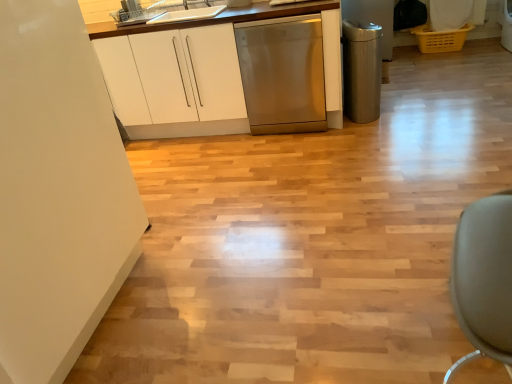
What do you see at coordinates (136, 12) in the screenshot? This screenshot has width=512, height=384. I see `metallic dishwasher at upper center, the 2th appliance positioned from the bottom` at bounding box center [136, 12].

Image resolution: width=512 pixels, height=384 pixels. What do you see at coordinates (283, 74) in the screenshot?
I see `stainless steel dishwasher at center` at bounding box center [283, 74].

The width and height of the screenshot is (512, 384). Find the location of `matte gray swivel chair at lower right`. matte gray swivel chair at lower right is located at coordinates (484, 279).

Considering the sizes of objects polished stainless steel trash can at right, the first appliance viewed from the right, and matte gray swivel chair at lower right in the image provided, who is shorter, polished stainless steel trash can at right, the first appliance viewed from the right, or matte gray swivel chair at lower right?

polished stainless steel trash can at right, the first appliance viewed from the right, is shorter.

Is point (361, 54) closer or farther from the camera than point (467, 223)?

Point (361, 54) is positioned farther from the camera compared to point (467, 223).

Is polished stainless steel trash can at right, the first appliance ordered from the bottom, not near matte gray swivel chair at lower right?

Yes, polished stainless steel trash can at right, the first appliance ordered from the bottom, and matte gray swivel chair at lower right are quite far apart.

Identify the location of swivel chair in front of the polished stainless steel trash can at right, the second appliance positioned from the left. The width and height of the screenshot is (512, 384). (484, 279).

Which of these two, white glossy cabinet at upper left or metallic dishwasher at upper center, arranged as the first appliance when viewed from the left, is bigger?

Bigger between the two is white glossy cabinet at upper left.

Is white glossy cabinet at upper left inside the boundaries of metallic dishwasher at upper center, the 2th appliance positioned from the bottom, or outside?

white glossy cabinet at upper left is outside metallic dishwasher at upper center, the 2th appliance positioned from the bottom.

Where is `appliance located above the white glossy cabinet at upper left (from a real-world perspective)`? Image resolution: width=512 pixels, height=384 pixels. appliance located above the white glossy cabinet at upper left (from a real-world perspective) is located at coordinates (136, 12).

From a real-world perspective, is white glossy cabinet at upper left positioned over metallic dishwasher at upper center, the 2th appliance from the right, based on gravity?

No, from a real-world perspective, white glossy cabinet at upper left is not over metallic dishwasher at upper center, the 2th appliance from the right

Where is `cabinetry below the polished stainless steel trash can at right, the first appliance viewed from the right (from the image's perspective)`? This screenshot has width=512, height=384. cabinetry below the polished stainless steel trash can at right, the first appliance viewed from the right (from the image's perspective) is located at coordinates (201, 72).

Can you tell me how much white glossy cabinet at upper left and polished stainless steel trash can at right, which appears as the 2th appliance when viewed from the top, differ in facing direction?

The facing directions of white glossy cabinet at upper left and polished stainless steel trash can at right, which appears as the 2th appliance when viewed from the top, are 96.4 degrees apart.

Is white glossy cabinet at upper left positioned with its back to polished stainless steel trash can at right, the first appliance ordered from the bottom?

white glossy cabinet at upper left does not have its back to polished stainless steel trash can at right, the first appliance ordered from the bottom.

Considering the sizes of white glossy cabinet at upper left and polished stainless steel trash can at right, which appears as the 2th appliance when viewed from the top, in the image, is white glossy cabinet at upper left wider or thinner than polished stainless steel trash can at right, which appears as the 2th appliance when viewed from the top,?

white glossy cabinet at upper left is wider than polished stainless steel trash can at right, which appears as the 2th appliance when viewed from the top.

Between metallic dishwasher at upper center, marked as the 1th appliance in a top-to-bottom arrangement, and polished stainless steel trash can at right, the first appliance viewed from the right, which one has less height?

With less height is metallic dishwasher at upper center, marked as the 1th appliance in a top-to-bottom arrangement.

In the scene shown: Is metallic dishwasher at upper center, marked as the 1th appliance in a top-to-bottom arrangement, spatially inside polished stainless steel trash can at right, the first appliance ordered from the bottom, or outside of it?

metallic dishwasher at upper center, marked as the 1th appliance in a top-to-bottom arrangement, is outside polished stainless steel trash can at right, the first appliance ordered from the bottom.

Which of these two, metallic dishwasher at upper center, the 2th appliance from the right, or polished stainless steel trash can at right, the first appliance viewed from the right, is thinner?

With smaller width is polished stainless steel trash can at right, the first appliance viewed from the right.

Is metallic dishwasher at upper center, arranged as the first appliance when viewed from the left, to the left or to the right of polished stainless steel trash can at right, the second appliance positioned from the left, in the image?

From the image, it's evident that metallic dishwasher at upper center, arranged as the first appliance when viewed from the left, is to the left of polished stainless steel trash can at right, the second appliance positioned from the left.

Based on the photo, from a real-world perspective, is polished stainless steel trash can at right, the second appliance positioned from the left, on stainless steel dishwasher at center?

No, from a real-world perspective, polished stainless steel trash can at right, the second appliance positioned from the left, is not on top of stainless steel dishwasher at center.

Measure the distance from polished stainless steel trash can at right, the first appliance viewed from the right, to stainless steel dishwasher at center.

polished stainless steel trash can at right, the first appliance viewed from the right, and stainless steel dishwasher at center are 20.45 inches apart from each other.

Considering the points (378, 89) and (324, 126), which point is in front, point (378, 89) or point (324, 126)?

Positioned in front is point (324, 126).

Is stainless steel dishwasher at center at the back of polished stainless steel trash can at right, the first appliance ordered from the bottom?

Yes, polished stainless steel trash can at right, the first appliance ordered from the bottom, is positioned with its back facing stainless steel dishwasher at center.

From their relative heights in the image, would you say metallic dishwasher at upper center, the 2th appliance positioned from the bottom, is taller or shorter than white glossy cabinet at upper left?

In the image, metallic dishwasher at upper center, the 2th appliance positioned from the bottom, appears to be shorter than white glossy cabinet at upper left.

Could you measure the distance between metallic dishwasher at upper center, the 2th appliance positioned from the bottom, and white glossy cabinet at upper left?

A distance of 21.18 inches exists between metallic dishwasher at upper center, the 2th appliance positioned from the bottom, and white glossy cabinet at upper left.

From the image's perspective, would you say metallic dishwasher at upper center, arranged as the first appliance when viewed from the left, is shown under white glossy cabinet at upper left?

No.

From a real-world perspective, is metallic dishwasher at upper center, the 2th appliance from the right, positioned above or below white glossy cabinet at upper left?

Clearly, from a real-world perspective, metallic dishwasher at upper center, the 2th appliance from the right, is above white glossy cabinet at upper left.

Relative to polished stainless steel trash can at right, the first appliance viewed from the right, is matte gray swivel chair at lower right in front or behind?

Visually, matte gray swivel chair at lower right is located in front of polished stainless steel trash can at right, the first appliance viewed from the right.

Does point (460, 291) come closer to viewer compared to point (354, 73)?

Yes, point (460, 291) is closer to viewer.

Is polished stainless steel trash can at right, the first appliance ordered from the bottom, surrounded by matte gray swivel chair at lower right?

No, matte gray swivel chair at lower right does not contain polished stainless steel trash can at right, the first appliance ordered from the bottom.

Where is `appliance that is on the right side of matte gray swivel chair at lower right`? This screenshot has height=384, width=512. appliance that is on the right side of matte gray swivel chair at lower right is located at coordinates (361, 70).

At what (x,y) coordinates should I click in order to perform the action: click on appliance located above the white glossy cabinet at upper left (from a real-world perspective). Please return your answer as a coordinate pair (x, y). Looking at the image, I should click on (136, 12).

Estimate the real-world distances between objects in this image. Which object is closer to polished stainless steel trash can at right, the first appliance viewed from the right, metallic dishwasher at upper center, marked as the 1th appliance in a top-to-bottom arrangement, or white glossy cabinet at upper left?

white glossy cabinet at upper left is closer to polished stainless steel trash can at right, the first appliance viewed from the right.

When comparing their distances from white glossy cabinet at upper left, does stainless steel dishwasher at center or metallic dishwasher at upper center, arranged as the first appliance when viewed from the left, seem further?

The object further to white glossy cabinet at upper left is metallic dishwasher at upper center, arranged as the first appliance when viewed from the left.

Based on their spatial positions, is matte gray swivel chair at lower right or stainless steel dishwasher at center closer to white glossy cabinet at upper left?

The object closer to white glossy cabinet at upper left is stainless steel dishwasher at center.

Which object lies further to the anchor point stainless steel dishwasher at center, white glossy cabinet at upper left or matte gray swivel chair at lower right?

matte gray swivel chair at lower right lies further to stainless steel dishwasher at center than the other object.

When comparing their distances from stainless steel dishwasher at center, does polished stainless steel trash can at right, which appears as the 2th appliance when viewed from the top, or white glossy cabinet at upper left seem further?

polished stainless steel trash can at right, which appears as the 2th appliance when viewed from the top, lies further to stainless steel dishwasher at center than the other object.

When comparing their distances from polished stainless steel trash can at right, the first appliance viewed from the right, does white glossy cabinet at upper left or metallic dishwasher at upper center, arranged as the first appliance when viewed from the left, seem further?

metallic dishwasher at upper center, arranged as the first appliance when viewed from the left.

Looking at the image, which one is located closer to stainless steel dishwasher at center, white glossy sink at upper center or white glossy cabinet at upper left?

Based on the image, white glossy cabinet at upper left appears to be nearer to stainless steel dishwasher at center.

From the image, which object appears to be nearer to matte gray swivel chair at lower right, polished stainless steel trash can at right, the second appliance positioned from the left, or white glossy sink at upper center?

polished stainless steel trash can at right, the second appliance positioned from the left.

I want to click on appliance located between matte gray swivel chair at lower right and metallic dishwasher at upper center, arranged as the first appliance when viewed from the left, in the depth direction, so click(x=361, y=70).

I want to click on home appliance between matte gray swivel chair at lower right and white glossy cabinet at upper left in the front-back direction, so click(283, 74).

You are a GUI agent. You are given a task and a screenshot of the screen. Output one action in this format:
    pyautogui.click(x=<x>, y=<y>)
    Task: Click on the cabinetry between matte gray swivel chair at lower right and polished stainless steel trash can at right, the first appliance viewed from the right, along the z-axis
    
    Given the screenshot: What is the action you would take?
    pyautogui.click(x=201, y=72)

I want to click on appliance positioned between matte gray swivel chair at lower right and white glossy sink at upper center from near to far, so click(361, 70).